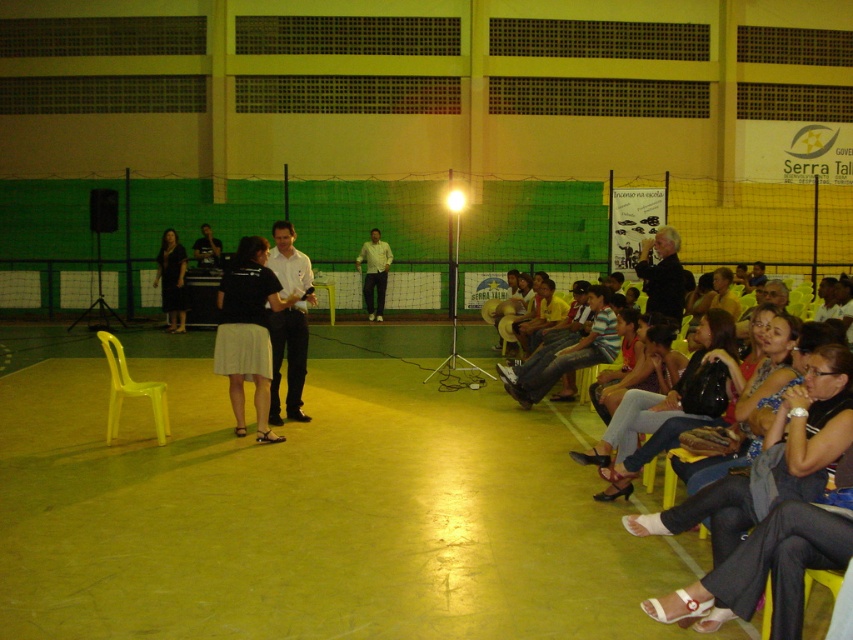
Question: Estimate the real-world distances between objects in this image. Which object is farther from the denim jeans at lower right?

Choices:
 (A) matte yellow chairs at lower right
 (B) white glossy shirt at center
 (C) matte black laptop at center
 (D) light yellow shirt at center

Answer: (C)

Question: Which point is closer to the camera?

Choices:
 (A) white glossy shirt at center
 (B) denim jeans at lower right

Answer: (B)

Question: Does matte yellow chairs at lower right come in front of black fabric skirt at center?

Choices:
 (A) yes
 (B) no

Answer: (A)

Question: Which point is farther to the camera?

Choices:
 (A) (183, 304)
 (B) (312, 285)
 (C) (364, 282)
 (D) (666, 392)

Answer: (C)

Question: Does matte yellow chairs at lower right have a lesser width compared to black fabric skirt at center?

Choices:
 (A) no
 (B) yes

Answer: (B)

Question: Is denim jeans at lower right below yellow plastic chair at center?

Choices:
 (A) yes
 (B) no

Answer: (A)